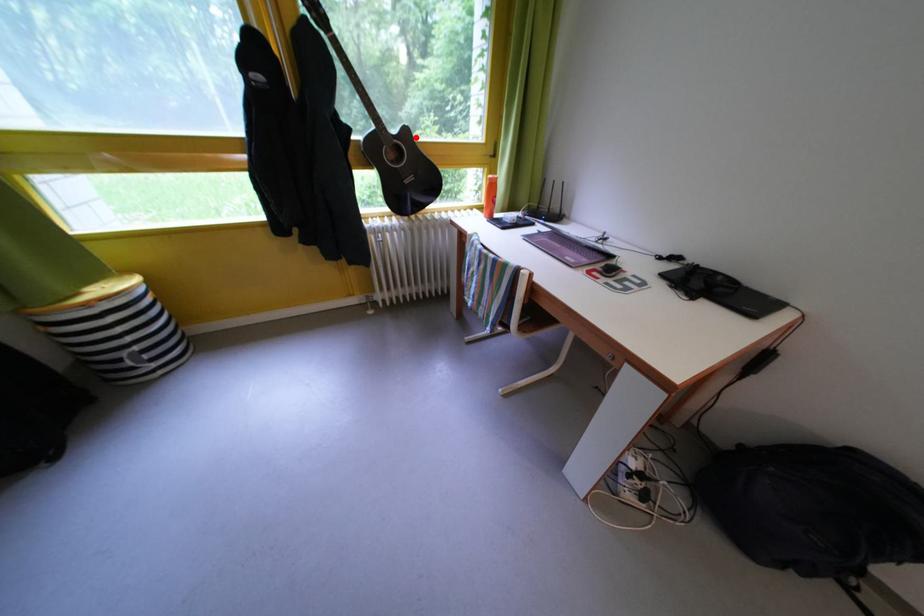
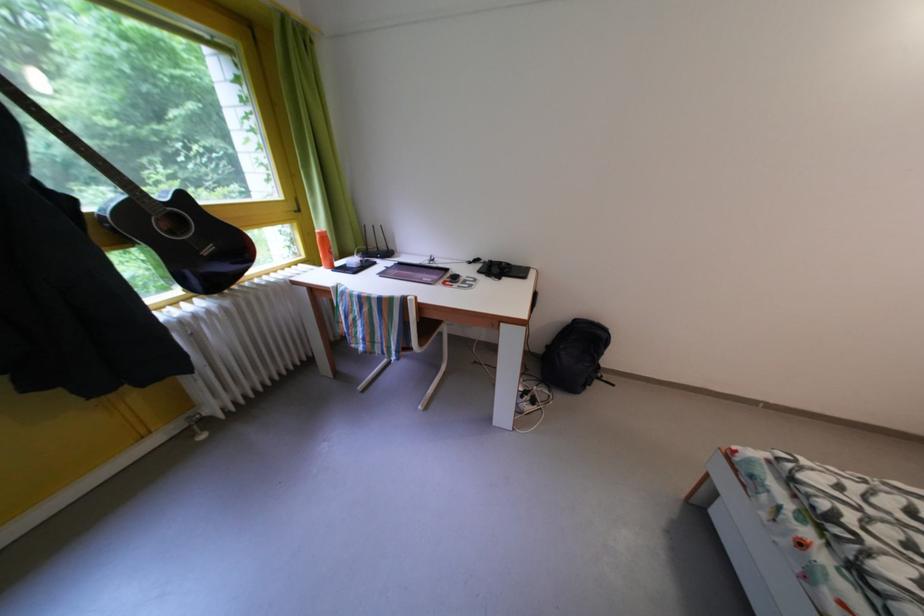
In the second image, find the point that corresponds to the highlighted location in the first image.

(191, 203)